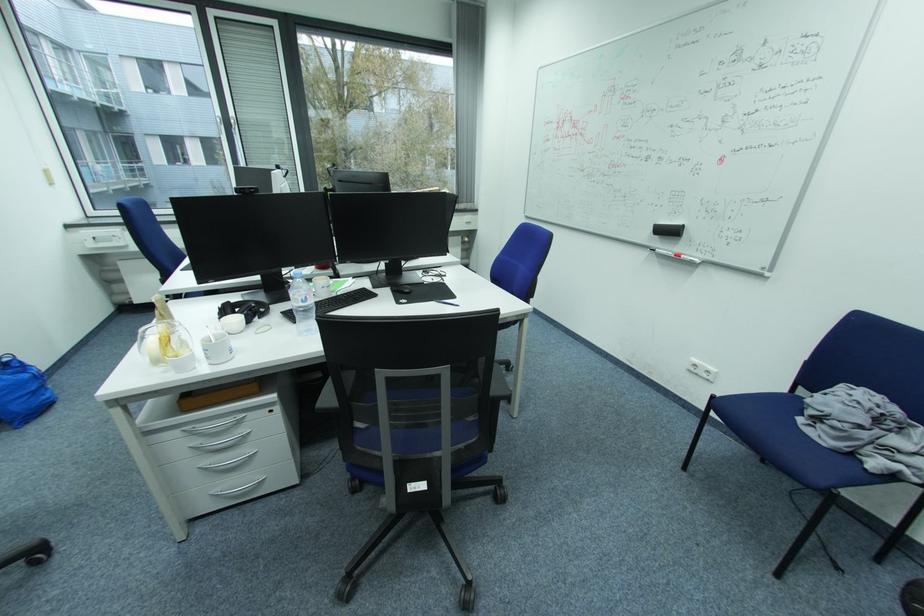
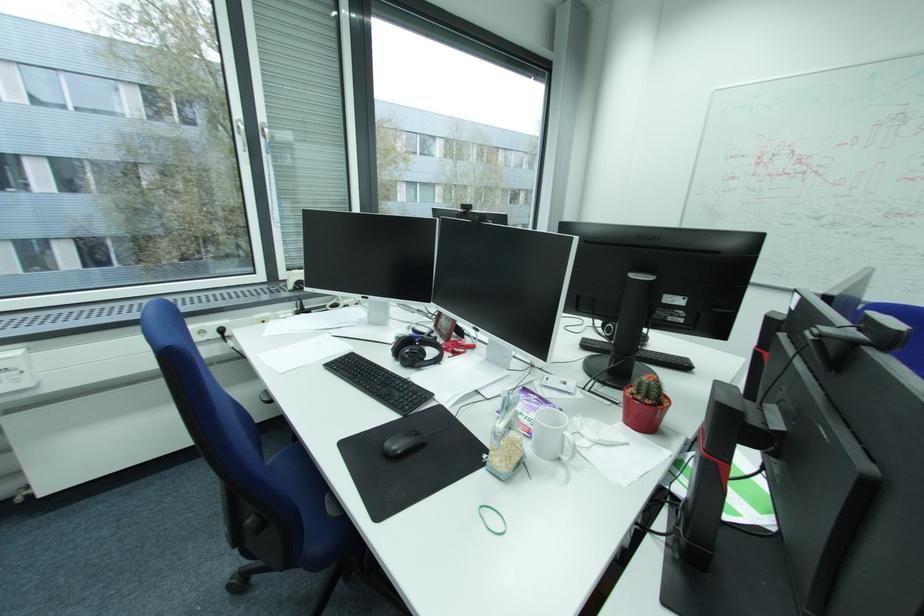
The point at (226, 118) is marked in the first image. Where is the corresponding point in the second image?

(247, 121)